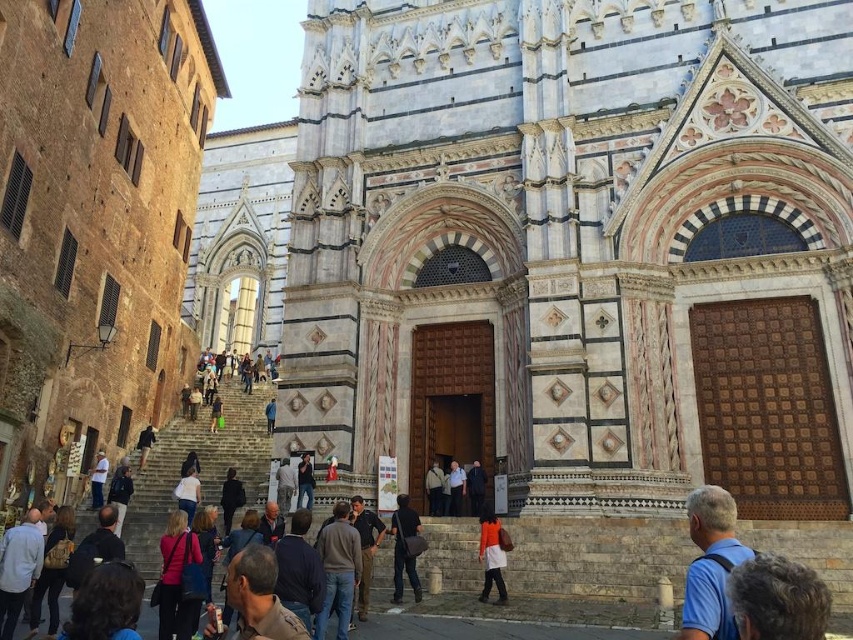
You are a tourist standing at the base of the gray stone stairs at center, and you want to take a photo of the cathedral. To ensure the blue fabric shirt at lower right doesn not block the view, should you move to the left or right?

The gray stone stairs at center are wider than the blue fabric shirt at lower right. Moving to the left or right will depend on the shirt position. Since the shirt is at lower right, moving left would place it out of frame, ensuring the cathedral remains visible.

You are a tourist standing at the base of the cathedral and you have two bags with you. You want to place both bags on a bench that is 100 feet away from you. The light brown leather backpack at lower left is currently 71.35 feet away from the orange fabric bag at center. Can you determine if both bags can be placed on the bench without moving them closer to each other?

The light brown leather backpack at lower left is 71.35 feet away from the orange fabric bag at center. Since the bench is 100 feet away from you, and the distance between the two bags is less than 100 feet, both bags can be placed on the bench without needing to move them closer together.

You are a tourist standing at the entrance of the cathedral and want to take a photo of the gray stone stairs at center and the blue fabric shirt at lower right. Which object should you focus on first if you want to capture both in the same frame without moving the camera?

You should focus on the gray stone stairs at center first because it is shorter than the blue fabric shirt at lower right, allowing both to fit within the frame when starting from the lower position.